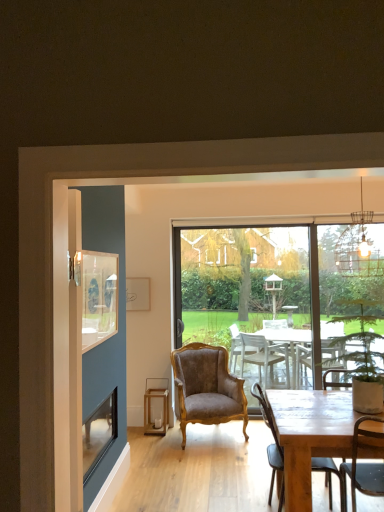
Question: Could you tell me if velvet brown armchair at center, arranged as the second chair when viewed from the front, is facing velvet brown armchair at center?

Choices:
 (A) yes
 (B) no

Answer: (A)

Question: From a real-world perspective, is velvet brown armchair at center, placed as the 2th chair when sorted from right to left, beneath velvet brown armchair at center?

Choices:
 (A) yes
 (B) no

Answer: (A)

Question: From a real-world perspective, is velvet brown armchair at center, placed as the 2th chair when sorted from right to left, positioned over velvet brown armchair at center based on gravity?

Choices:
 (A) yes
 (B) no

Answer: (B)

Question: Is velvet brown armchair at center, arranged as the second chair when viewed from the front, not inside velvet brown armchair at center?

Choices:
 (A) yes
 (B) no

Answer: (A)

Question: Could velvet brown armchair at center be considered to be inside velvet brown armchair at center, which appears as the 1th chair when viewed from the back?

Choices:
 (A) yes
 (B) no

Answer: (B)

Question: Is velvet brown armchair at center inside the boundaries of transparent glass window at center, or outside?

Choices:
 (A) outside
 (B) inside

Answer: (A)

Question: Is velvet brown armchair at center wider or thinner than transparent glass window at center?

Choices:
 (A) thin
 (B) wide

Answer: (B)

Question: In terms of height, does velvet brown armchair at center look taller or shorter compared to transparent glass window at center?

Choices:
 (A) tall
 (B) short

Answer: (B)

Question: From a real-world perspective, is velvet brown armchair at center physically located above or below transparent glass window at center?

Choices:
 (A) below
 (B) above

Answer: (A)

Question: Considering the positions of green leafy plant in pot at right and metallic wire cage at upper right in the image, is green leafy plant in pot at right taller or shorter than metallic wire cage at upper right?

Choices:
 (A) short
 (B) tall

Answer: (A)

Question: Does point (377, 332) appear closer or farther from the camera than point (370, 219)?

Choices:
 (A) closer
 (B) farther

Answer: (A)

Question: Looking at the image, does green leafy plant in pot at right seem bigger or smaller compared to metallic wire cage at upper right?

Choices:
 (A) small
 (B) big

Answer: (B)

Question: Is green leafy plant in pot at right in front of or behind metallic wire cage at upper right in the image?

Choices:
 (A) front
 (B) behind

Answer: (A)

Question: Is wooden lantern at lower center inside or outside of wooden chair at lower right, which is the first chair from right to left?

Choices:
 (A) outside
 (B) inside

Answer: (A)

Question: From a real-world perspective, is wooden lantern at lower center positioned above or below wooden chair at lower right, which ranks as the second chair in back-to-front order?

Choices:
 (A) below
 (B) above

Answer: (A)